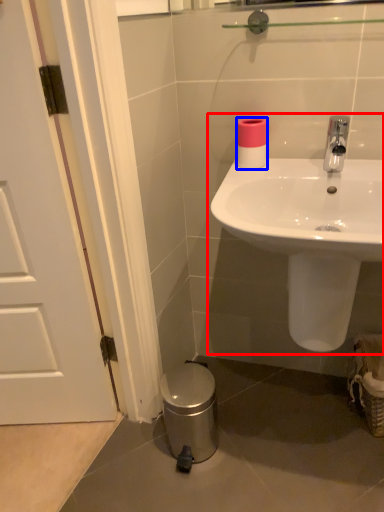
Question: Which point is closer to the camera, sink (highlighted by a red box) or toilet paper (highlighted by a blue box)?

Choices:
 (A) sink
 (B) toilet paper

Answer: (A)